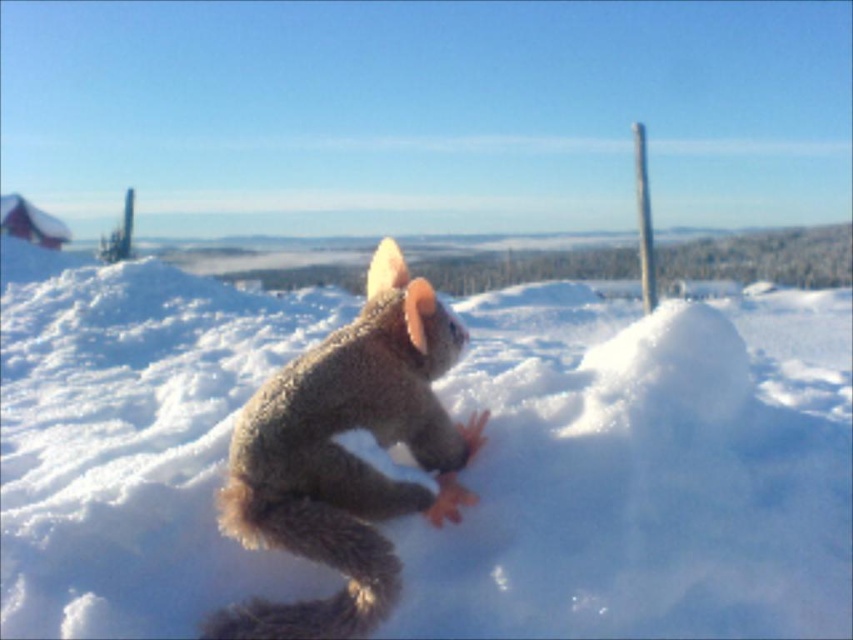
Question: Which object is farther from the camera taking this photo?

Choices:
 (A) fuzzy brown squirrel at center
 (B) white fluffy snow at center

Answer: (B)

Question: Is white fluffy snow at center wider than fuzzy brown squirrel at center?

Choices:
 (A) no
 (B) yes

Answer: (B)

Question: Which of the following is the farthest from the observer?

Choices:
 (A) fuzzy brown squirrel at center
 (B) white fluffy snow at center

Answer: (B)

Question: Which point is farther to the camera?

Choices:
 (A) (364, 419)
 (B) (35, 429)

Answer: (B)

Question: Is white fluffy snow at center thinner than fuzzy brown squirrel at center?

Choices:
 (A) yes
 (B) no

Answer: (B)

Question: Observing the image, what is the correct spatial positioning of white fluffy snow at center in reference to fuzzy brown squirrel at center?

Choices:
 (A) left
 (B) right

Answer: (A)